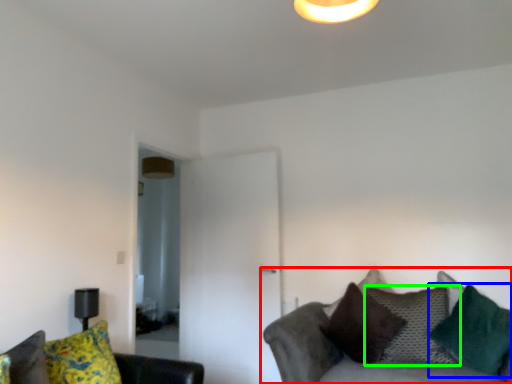
Question: Estimate the real-world distances between objects in this image. Which object is closer to studio couch (highlighted by a red box), pillow (highlighted by a blue box) or pillow (highlighted by a green box)?

Choices:
 (A) pillow
 (B) pillow

Answer: (B)